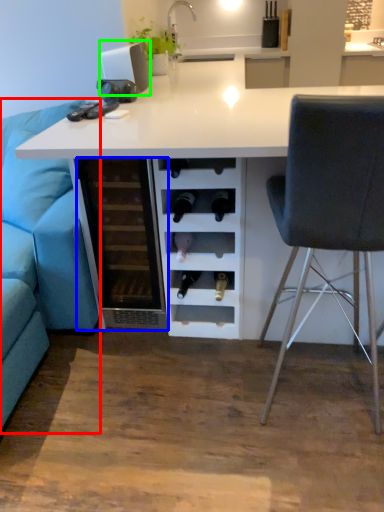
Question: Which is nearer to the studio couch (highlighted by a red box)? file cabinet (highlighted by a blue box) or appliance (highlighted by a green box).

Choices:
 (A) file cabinet
 (B) appliance

Answer: (A)